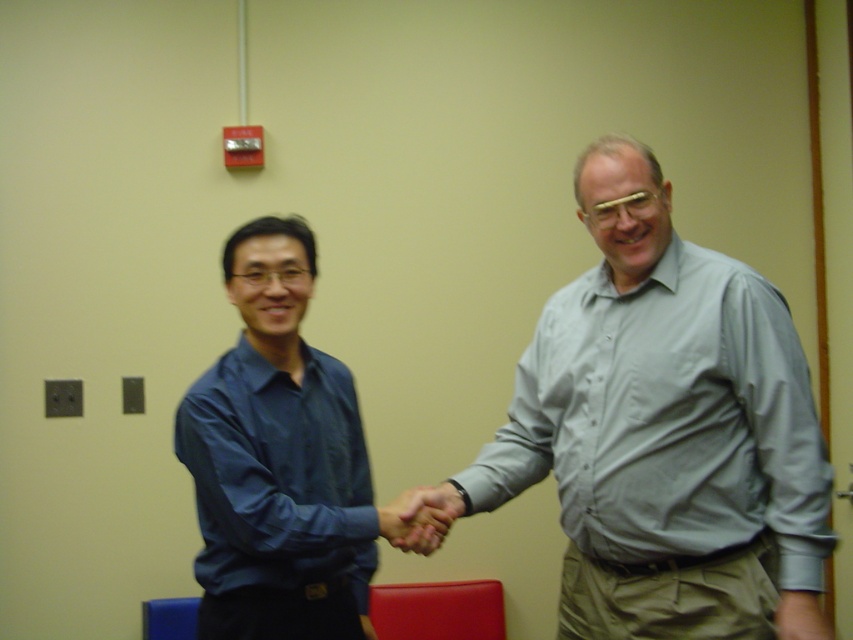
You are an interior designer assessing the space between the matte blue shirt at center and the smooth skin handshake at center. Can you fit a 10cm wide decorative plate between them?

The matte blue shirt at center is bigger than the smooth skin handshake at center, but the description does not provide specific distance measurements between them. Therefore, it is unclear if a 10cm wide decorative plate can fit between them.